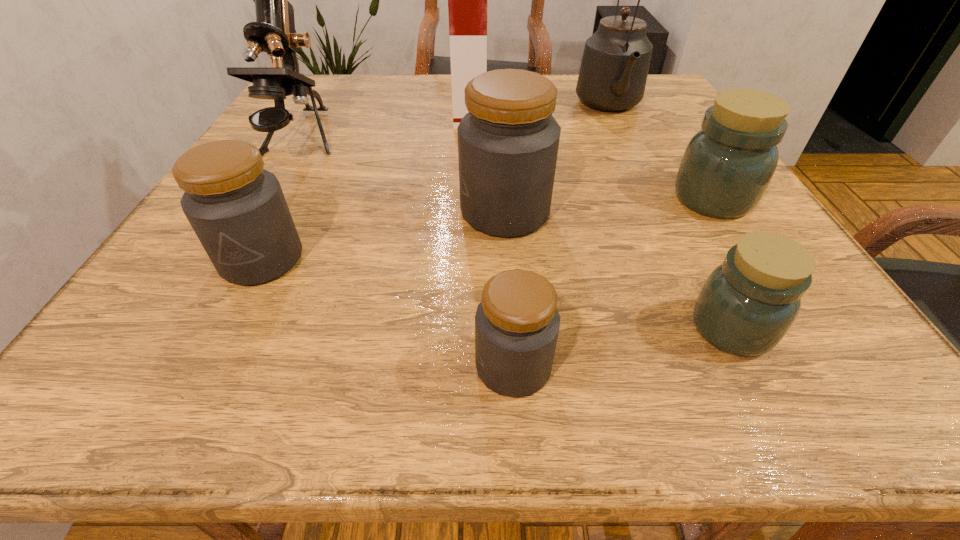
Locate an element on the screen. This screenshot has height=540, width=960. vacant area between the red cigarette_case and the farther green jar is located at coordinates (591, 153).

Identify which object is the closest to the tallest jar. Please provide its 2D coordinates. Your answer should be formatted as a tuple, i.e. [(x, y)], where the tuple contains the x and y coordinates of a point satisfying the conditions above.

[(517, 324)]

Point out which object is positioned as the seventh nearest to the leftmost jar. Please provide its 2D coordinates. Your answer should be formatted as a tuple, i.e. [(x, y)], where the tuple contains the x and y coordinates of a point satisfying the conditions above.

[(613, 73)]

The image size is (960, 540). I want to click on the second closest jar to the microscope, so click(508, 142).

Identify which jar is the third nearest to the biggest gray jar. Please provide its 2D coordinates. Your answer should be formatted as a tuple, i.e. [(x, y)], where the tuple contains the x and y coordinates of a point satisfying the conditions above.

[(727, 166)]

Identify which gray jar is located as the nearest to the smallest gray jar. Please provide its 2D coordinates. Your answer should be formatted as a tuple, i.e. [(x, y)], where the tuple contains the x and y coordinates of a point satisfying the conditions above.

[(508, 142)]

Locate which gray jar ranks in proximity to the microscope. Please provide its 2D coordinates. Your answer should be formatted as a tuple, i.e. [(x, y)], where the tuple contains the x and y coordinates of a point satisfying the conditions above.

[(237, 209)]

The image size is (960, 540). I want to click on free space that satisfies the following two spatial constraints: 1. through the eyepiece of the microscope; 2. on the right side of the bigger green jar, so click(268, 199).

What are the coordinates of `vacant space that satisfies the following two spatial constraints: 1. on the back side of the farther green jar; 2. on the front-facing side of the cigarette_case` in the screenshot? It's located at (654, 107).

Where is `free space that satisfies the following two spatial constraints: 1. through the eyepiece of the bigger green jar; 2. on the right side of the microscope`? free space that satisfies the following two spatial constraints: 1. through the eyepiece of the bigger green jar; 2. on the right side of the microscope is located at coordinates (268, 199).